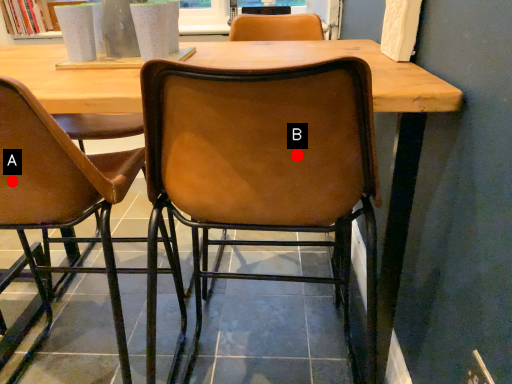
Question: Two points are circled on the image, labeled by A and B beside each circle. Which point is closer to the camera?

Choices:
 (A) A is closer
 (B) B is closer

Answer: (B)